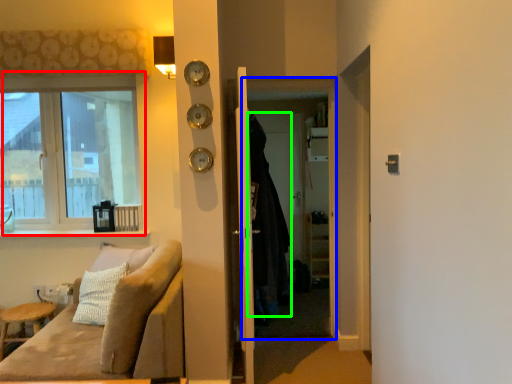
Question: Which is farther away from window (highlighted by a red box)? screen door (highlighted by a blue box) or cloak (highlighted by a green box)?

Choices:
 (A) screen door
 (B) cloak

Answer: (B)